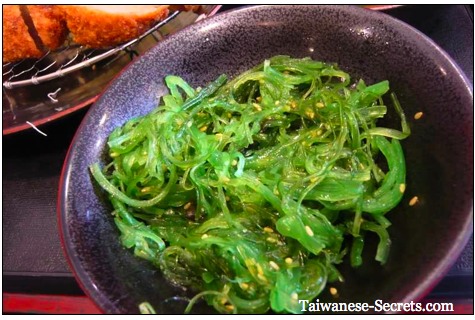
I want to click on red frame of table, so click(x=52, y=304).